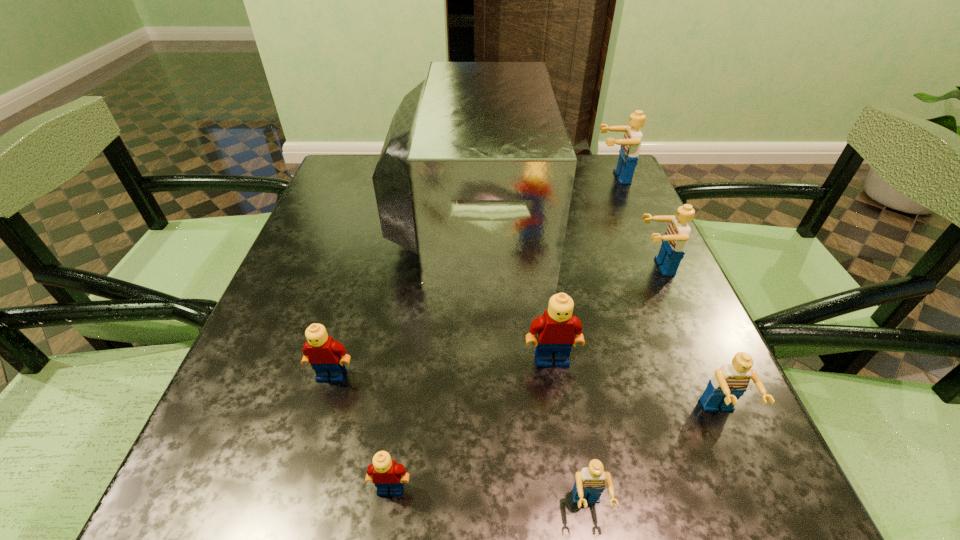
Locate an element on the screen. The height and width of the screenshot is (540, 960). vacant space positioned 0.400m on the face of the second farthest blue Lego is located at coordinates (444, 267).

Locate an element on the screen. This screenshot has height=540, width=960. free location located 0.350m on the face of the second farthest blue Lego is located at coordinates (468, 267).

In order to click on vacant point located 0.070m on the front-facing side of the biggest yellow Lego in this screenshot , I will do `click(559, 406)`.

Locate an element on the screen. Image resolution: width=960 pixels, height=540 pixels. free space located on the front-facing side of the leftmost yellow Lego is located at coordinates (318, 423).

Image resolution: width=960 pixels, height=540 pixels. In order to click on vacant point located 0.060m on the face of the third farthest blue Lego in this screenshot , I will do `click(748, 475)`.

Identify the location of microwave oven positioned at the far edge. (476, 173).

Where is `Lego present at the far edge`? The image size is (960, 540). Lego present at the far edge is located at coordinates (630, 144).

Where is `object situated at the left edge`? The image size is (960, 540). object situated at the left edge is located at coordinates click(x=326, y=356).

Locate an element on the screen. This screenshot has height=540, width=960. object situated at the far right corner is located at coordinates (630, 144).

In the image, there is a desktop. Where is `free space at the near edge`? The width and height of the screenshot is (960, 540). free space at the near edge is located at coordinates (521, 471).